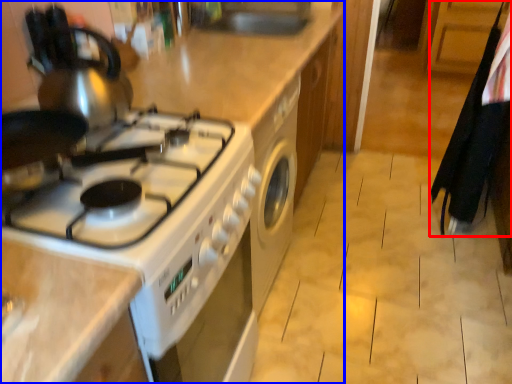
Question: Which object appears closest to the camera in this image, laundry (highlighted by a red box) or kitchen appliance (highlighted by a blue box)?

Choices:
 (A) laundry
 (B) kitchen appliance

Answer: (B)